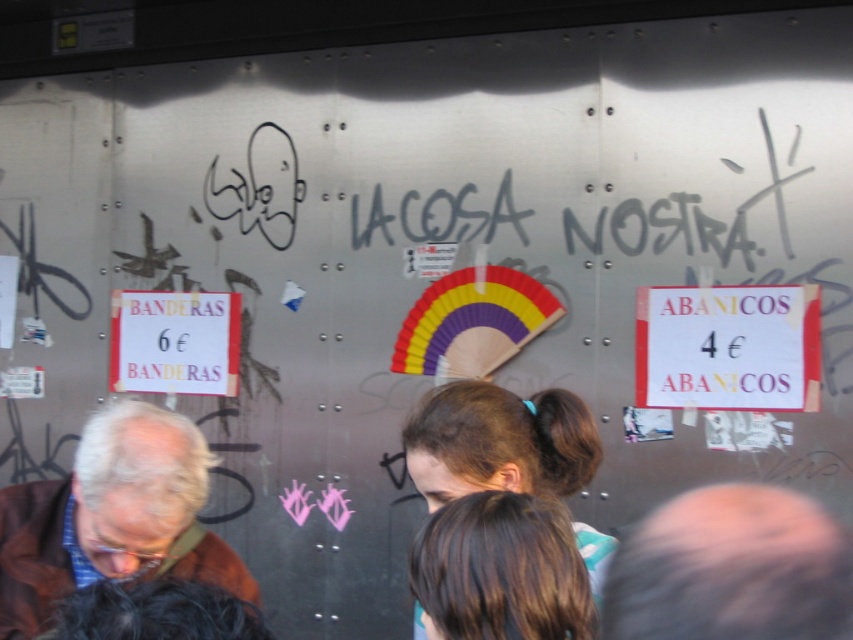
Question: Which point is closer to the camera?

Choices:
 (A) (113, 577)
 (B) (730, 317)
 (C) (566, 493)
 (D) (729, 547)

Answer: (D)

Question: Is smooth skin head at lower right to the right of white paper sign at left from the viewer's perspective?

Choices:
 (A) no
 (B) yes

Answer: (B)

Question: Is the position of brown hair at center more distant than that of white paper sign at left?

Choices:
 (A) yes
 (B) no

Answer: (B)

Question: Which point is farther to the camera?

Choices:
 (A) white paper sign at left
 (B) smooth skin head at lower right

Answer: (A)

Question: Which point is closer to the camera?

Choices:
 (A) white paper sign at left
 (B) smooth skin head at lower right

Answer: (B)

Question: Is brown hair at center thinner than white paper sign at left?

Choices:
 (A) no
 (B) yes

Answer: (B)